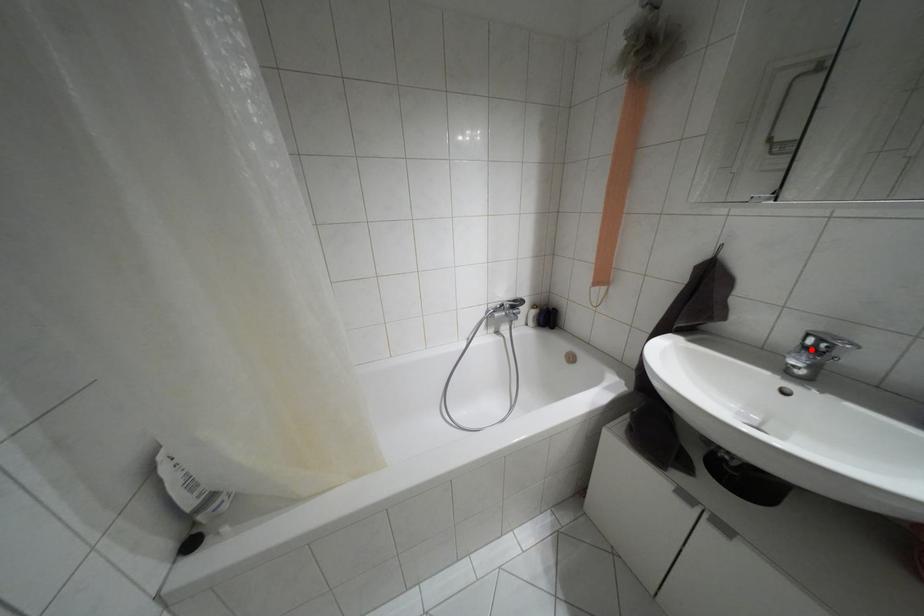
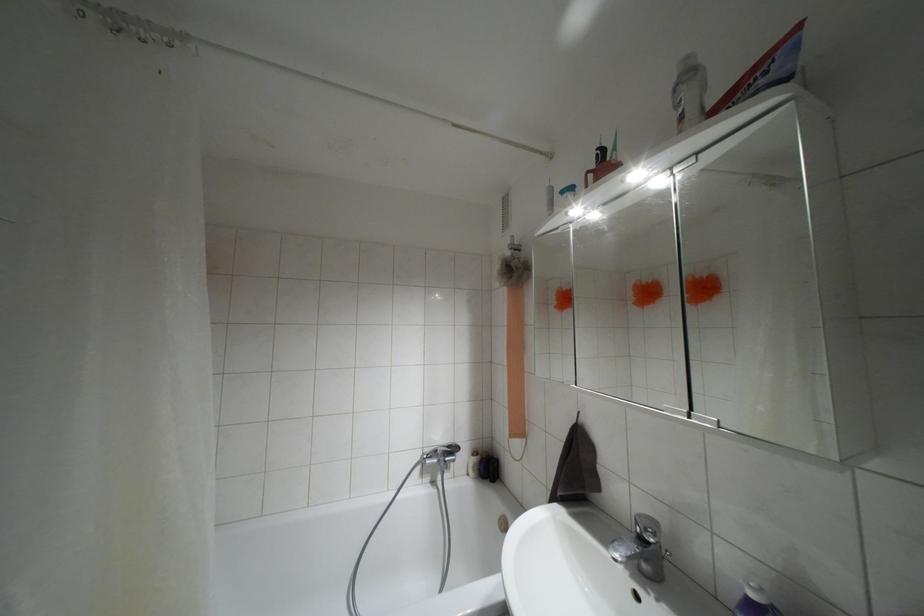
In the second image, find the point that corresponds to the highlighted location in the first image.

(641, 538)